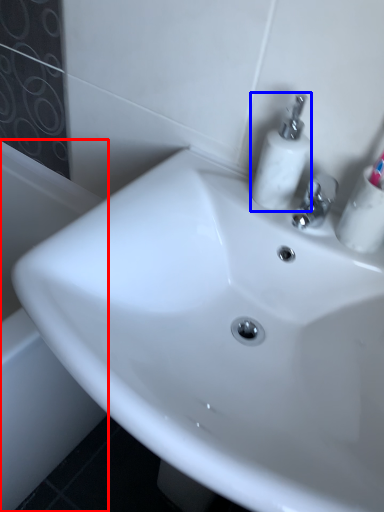
Question: Which of the following is the closest to the observer, bath (highlighted by a red box) or soap dispenser (highlighted by a blue box)?

Choices:
 (A) bath
 (B) soap dispenser

Answer: (B)